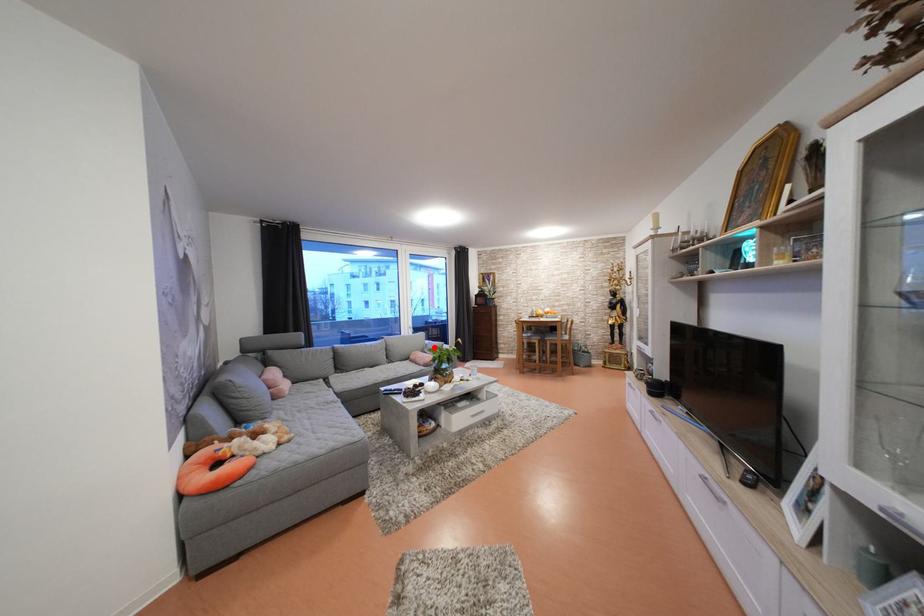
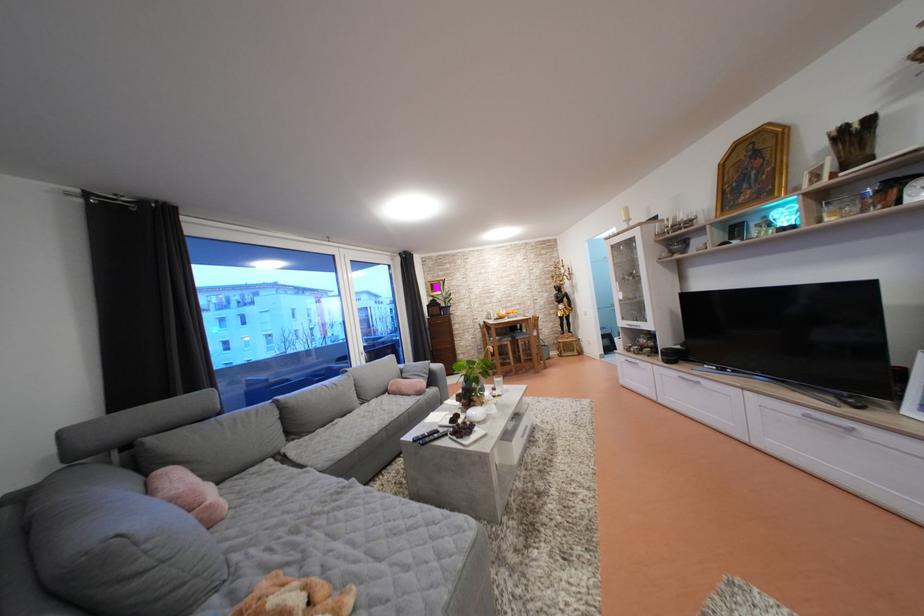
Question: I am providing you with two images of the same scene from different viewpoints. In image1, a red point is highlighted. Considering the same 3D point in image2, which of the following is correct?

Choices:
 (A) It is closer
 (B) It is farther

Answer: (B)